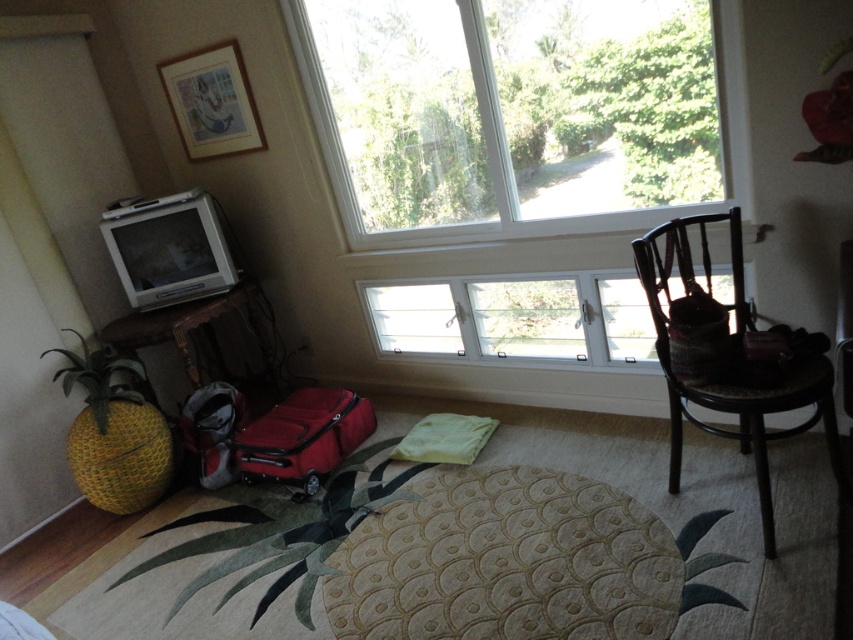
Describe the element at coordinates (729, 385) in the screenshot. The height and width of the screenshot is (640, 853). I see `dark brown woven chair at right` at that location.

In the scene shown: Can you confirm if dark brown woven chair at right is positioned above matte red suitcase at center?

Indeed, dark brown woven chair at right is positioned over matte red suitcase at center.

The image size is (853, 640). Describe the element at coordinates (729, 385) in the screenshot. I see `dark brown woven chair at right` at that location.

This screenshot has height=640, width=853. Identify the location of dark brown woven chair at right. (729, 385).

Is clear glass window at upper center above dark brown woven chair at right?

Yes.

Between point (675, 164) and point (692, 288), which one is positioned in front?

Point (692, 288)

You are a GUI agent. You are given a task and a screenshot of the screen. Output one action in this format:
    pyautogui.click(x=<x>, y=<y>)
    Task: Click on the clear glass window at upper center
    
    Given the screenshot: What is the action you would take?
    pyautogui.click(x=534, y=129)

From the picture: Does clear glass window at upper center have a smaller size compared to matte red suitcase at center?

No, clear glass window at upper center is not smaller than matte red suitcase at center.

Who is more forward, (x=457, y=10) or (x=335, y=403)?

Point (x=457, y=10) is more forward.

Is point (685, 195) less distant than point (305, 413)?

Yes.

Identify the location of clear glass window at upper center. The height and width of the screenshot is (640, 853). (534, 129).